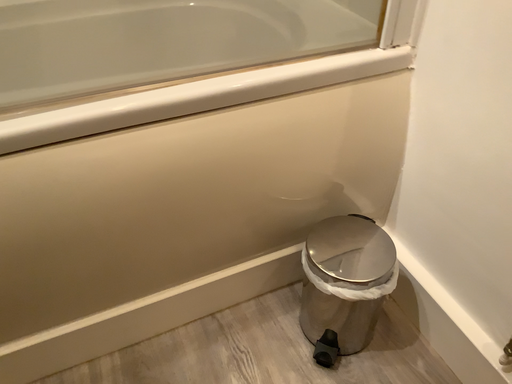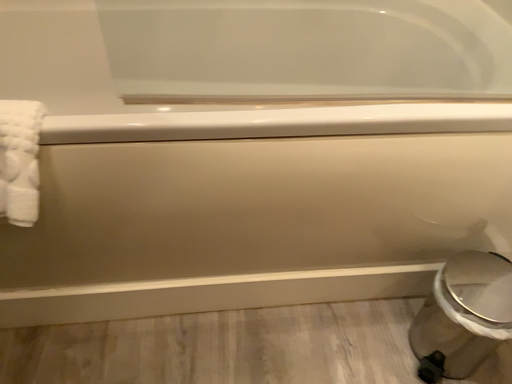
Question: Which way did the camera rotate in the video?

Choices:
 (A) rotated left
 (B) rotated right

Answer: (A)